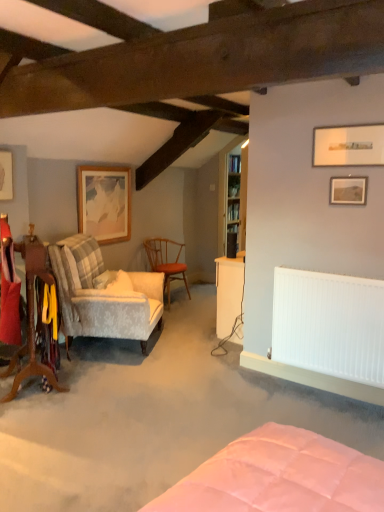
Question: Is matte white picture frame at upper right, which is the 2th picture frame from right to left, to the left or to the right of wooden plaid chair at left, which appears as the third chair when viewed from the back, in the image?

Choices:
 (A) left
 (B) right

Answer: (B)

Question: From a real-world perspective, is matte white picture frame at upper right, the first picture frame when ordered from front to back, physically located above or below wooden plaid chair at left, which appears as the third chair when viewed from the back?

Choices:
 (A) above
 (B) below

Answer: (A)

Question: Based on their relative distances, which object is farther from the matte wooden picture frame at upper right, marked as the 2th picture frame in a front-to-back arrangement?

Choices:
 (A) wooden textured chair at center, positioned as the 3th chair in front-to-back order
 (B) white smooth radiator at right
 (C) white soft pillow at left
 (D) matte white picture frame at upper right, the third picture frame in the left-to-right sequence
 (E) velvet-patterned armchair at left, which is the second chair from back to front

Answer: (A)

Question: Estimate the real-world distances between objects in this image. Which object is closer to the white smooth radiator at right?

Choices:
 (A) wooden textured chair at center, arranged as the first chair when viewed from the back
 (B) wooden bookshelf at upper center
 (C) matte wooden picture frame at upper right, which appears as the 1th picture frame when viewed from the right
 (D) wooden framed artwork at upper left, the fourth picture frame when ordered from front to back
 (E) velvet-patterned armchair at left, the second chair when ordered from front to back

Answer: (C)